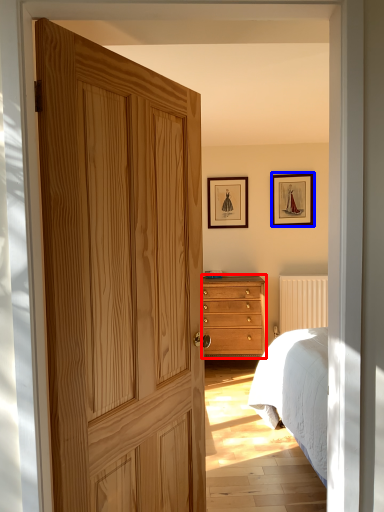
Question: Which object appears closest to the camera in this image, chest of drawers (highlighted by a red box) or picture frame (highlighted by a blue box)?

Choices:
 (A) chest of drawers
 (B) picture frame

Answer: (A)